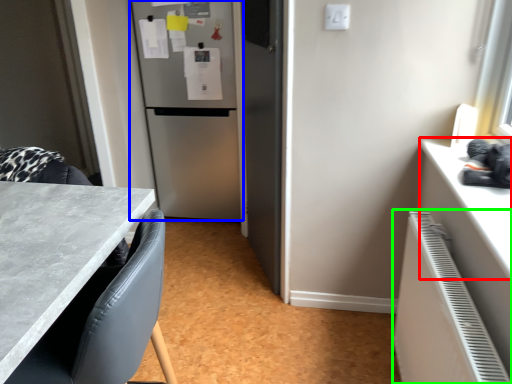
Question: Considering the real-world distances, which object is farthest from counter top (highlighted by a red box)? refrigerator (highlighted by a blue box) or radiator (highlighted by a green box)?

Choices:
 (A) refrigerator
 (B) radiator

Answer: (A)